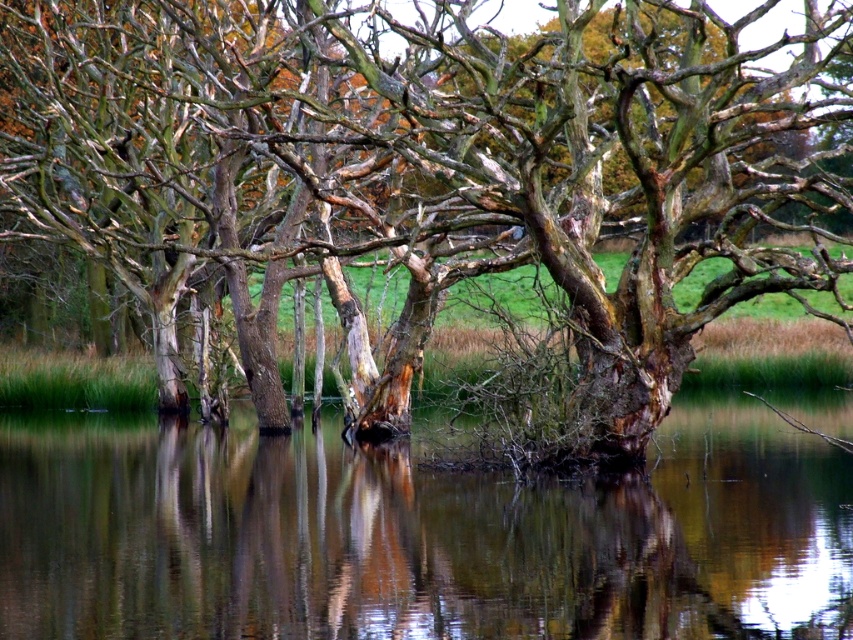
Who is higher up, transparent water at center or brown wood at center?

transparent water at center

Does transparent water at center have a greater height compared to brown wood at center?

Yes.

In order to click on transparent water at center in this screenshot , I will do `click(416, 536)`.

This screenshot has height=640, width=853. In order to click on transparent water at center in this screenshot , I will do `click(416, 536)`.

The height and width of the screenshot is (640, 853). I want to click on smooth bark tree at center, so click(x=428, y=164).

The height and width of the screenshot is (640, 853). Describe the element at coordinates (428, 164) in the screenshot. I see `smooth bark tree at center` at that location.

Locate an element on the screen. smooth bark tree at center is located at coordinates (428, 164).

Does smooth bark tree at center lie behind transparent water at center?

Yes, smooth bark tree at center is behind transparent water at center.

The width and height of the screenshot is (853, 640). I want to click on smooth bark tree at center, so (x=428, y=164).

This screenshot has width=853, height=640. I want to click on smooth bark tree at center, so click(x=428, y=164).